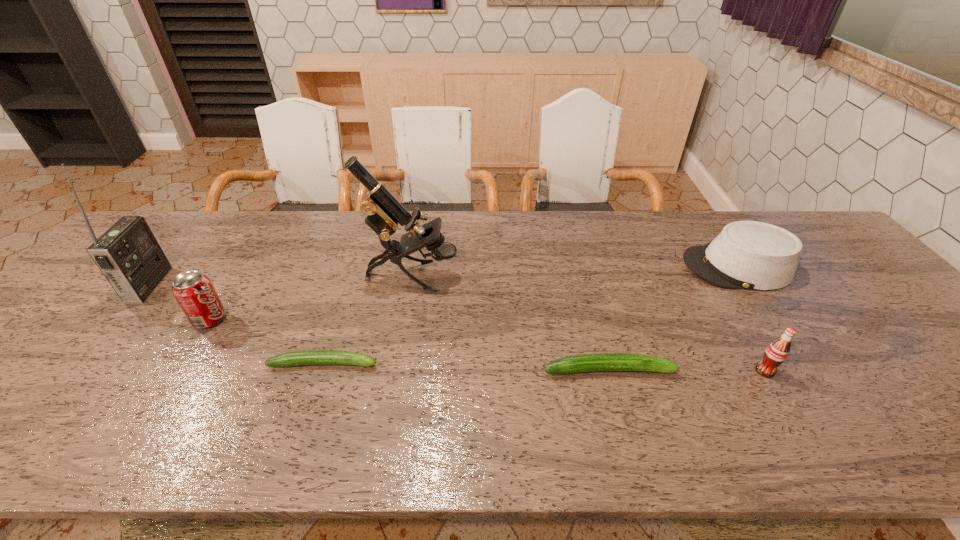
Please point a spot on the right to add another zucchini. Please provide its 2D coordinates. Your answer should be formatted as a tuple, i.e. [(x, y)], where the tuple contains the x and y coordinates of a point satisfying the conditions above.

[(900, 376)]